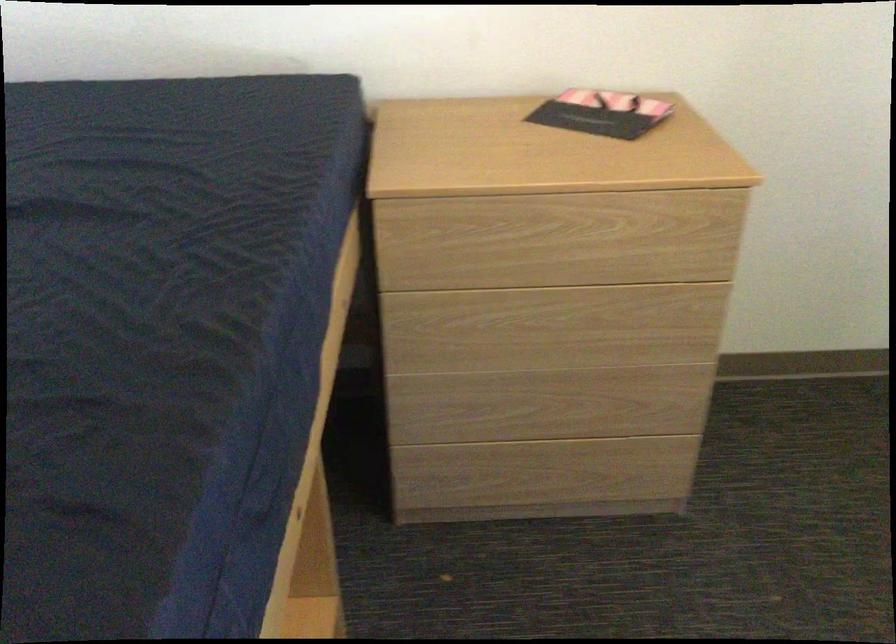
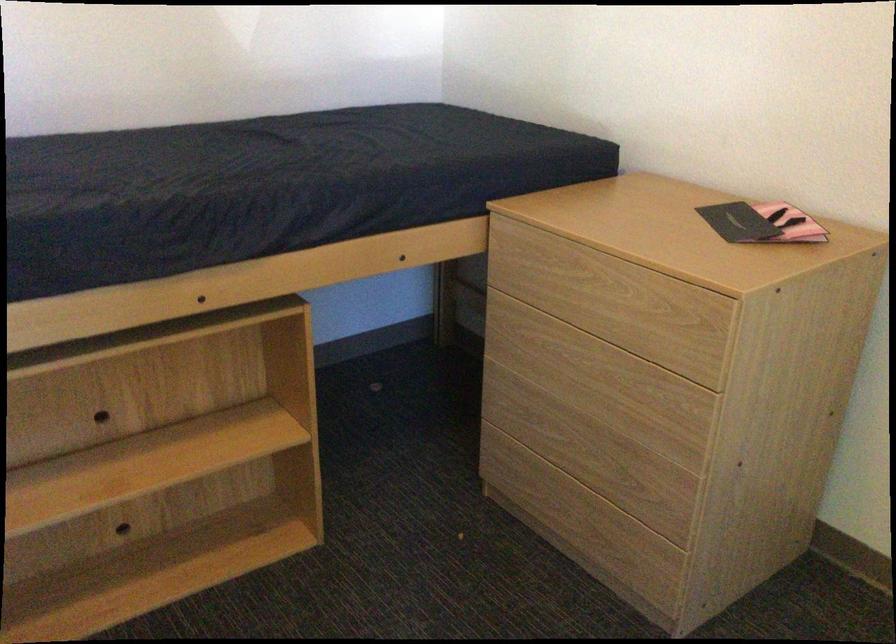
Where in the second image is the point corresponding to (607,399) from the first image?

(607, 464)